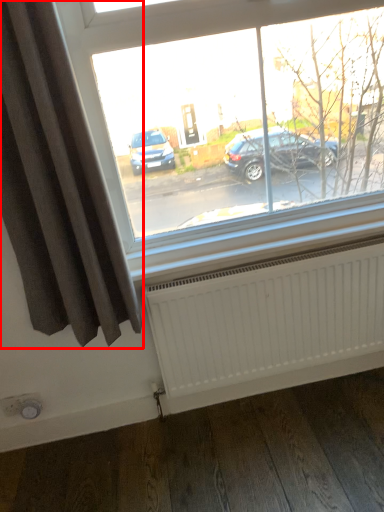
Question: From the image's perspective, what is the correct spatial positioning of curtain (annotated by the red box) in reference to radiator?

Choices:
 (A) below
 (B) above

Answer: (B)